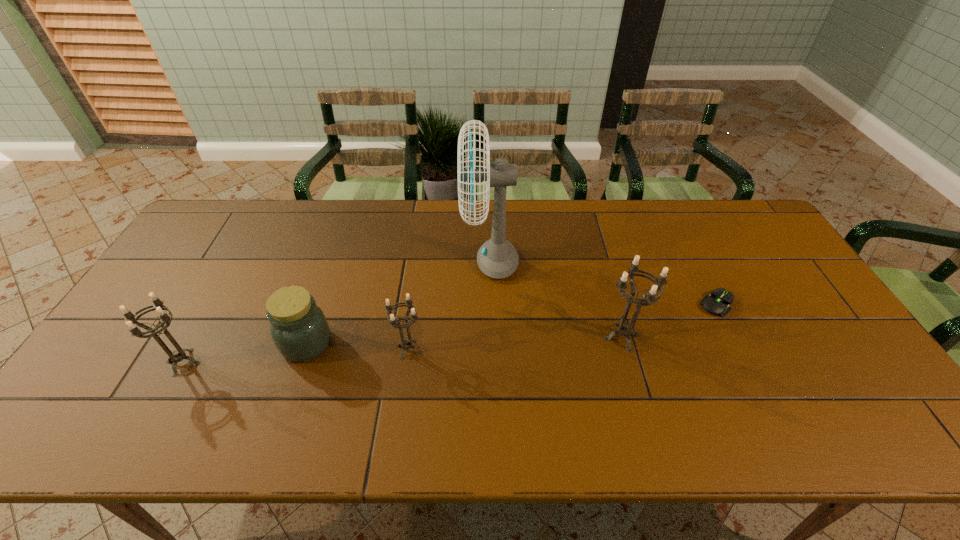
Find the location of a particular element. Image resolution: width=960 pixels, height=540 pixels. vacant area situated 0.350m on the back of the leftmost candle holder is located at coordinates 244,255.

You are a GUI agent. You are given a task and a screenshot of the screen. Output one action in this format:
    pyautogui.click(x=<x>, y=<y>)
    Task: Click on the vacant region located 0.120m on the right of the third object from left to right
    This screenshot has width=960, height=540.
    Given the screenshot: What is the action you would take?
    pyautogui.click(x=470, y=349)

Find the location of a particular element. free spot located on the back of the second object from right to left is located at coordinates (593, 233).

I want to click on free space located on the front-facing side of the third object from right to left, so click(363, 260).

You are a GUI agent. You are given a task and a screenshot of the screen. Output one action in this format:
    pyautogui.click(x=<x>, y=<y>)
    Task: Click on the free region located 0.220m on the front-facing side of the third object from right to left
    The image size is (960, 540).
    Given the screenshot: What is the action you would take?
    pyautogui.click(x=392, y=260)

Locate an element on the screen. The height and width of the screenshot is (540, 960). free space located on the front-facing side of the third object from right to left is located at coordinates coord(418,260).

This screenshot has height=540, width=960. Identify the location of vacant space located on the left of the jar. (147, 343).

The width and height of the screenshot is (960, 540). Find the location of `free point located on the front of the computer mouse`. free point located on the front of the computer mouse is located at coordinates [x=746, y=361].

Where is `object that is at the far edge`? object that is at the far edge is located at coordinates (497, 258).

Image resolution: width=960 pixels, height=540 pixels. I want to click on object at the near edge, so click(178, 355).